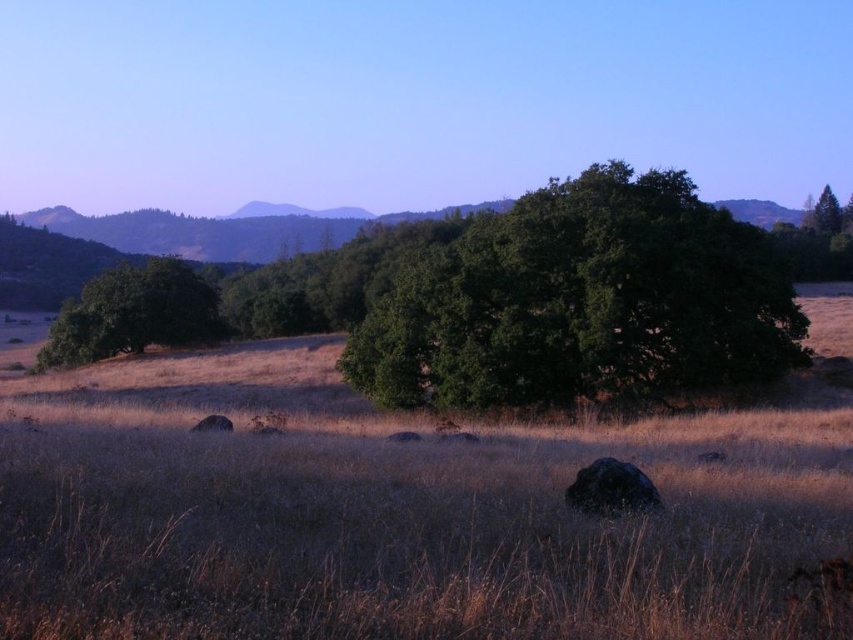
Based on the photo, does green leafy tree at center have a greater width compared to green leafy tree at left?

No.

Which of these two, green leafy tree at center or green leafy tree at left, stands shorter?

green leafy tree at center is shorter.

Where is `green leafy tree at center`? The height and width of the screenshot is (640, 853). green leafy tree at center is located at coordinates (582, 301).

Image resolution: width=853 pixels, height=640 pixels. In order to click on green leafy tree at center in this screenshot , I will do `click(582, 301)`.

Who is lower down, green leafy tree at center or green matte tree at upper right?

green leafy tree at center is lower down.

Is point (790, 312) closer to viewer compared to point (827, 214)?

Yes, point (790, 312) is closer to viewer.

Between point (665, 301) and point (824, 186), which one is positioned behind?

Point (824, 186)

You are a GUI agent. You are given a task and a screenshot of the screen. Output one action in this format:
    pyautogui.click(x=<x>, y=<y>)
    Task: Click on the green leafy tree at center
    Image resolution: width=853 pixels, height=640 pixels.
    Given the screenshot: What is the action you would take?
    pyautogui.click(x=582, y=301)

Does green leafy tree at left come behind green matte tree at upper right?

No, green leafy tree at left is in front of green matte tree at upper right.

Between green leafy tree at left and green matte tree at upper right, which one appears on the right side from the viewer's perspective?

green matte tree at upper right is more to the right.

Is point (117, 289) farther from viewer compared to point (839, 220)?

That is False.

Identify the location of green leafy tree at left. (134, 314).